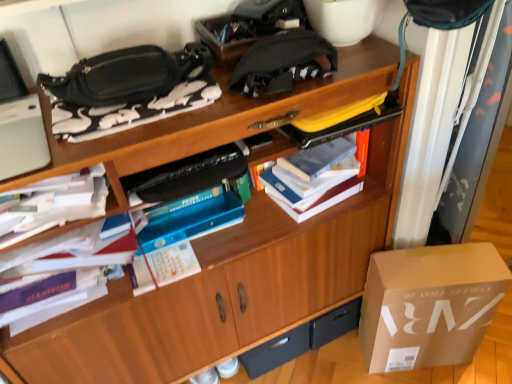
Question: Does white paper stack at left, the fourth book in the right-to-left sequence, appear on the left side of black matte drawer at lower center?

Choices:
 (A) no
 (B) yes

Answer: (B)

Question: Is the surface of white paper stack at left, which ranks as the 1th book in left-to-right order, in direct contact with black matte drawer at lower center?

Choices:
 (A) yes
 (B) no

Answer: (B)

Question: From a real-world perspective, is white paper stack at left, the fourth book in the right-to-left sequence, beneath black matte drawer at lower center?

Choices:
 (A) yes
 (B) no

Answer: (B)

Question: From the image's perspective, is white paper stack at left, the fourth book in the right-to-left sequence, over black matte drawer at lower center?

Choices:
 (A) yes
 (B) no

Answer: (A)

Question: From the image's perspective, does white paper stack at left, the fourth book in the right-to-left sequence, appear lower than black matte drawer at lower center?

Choices:
 (A) no
 (B) yes

Answer: (A)

Question: Is white paper at left, which is the second book in left-to-right order, wider or thinner than black fabric pouch at upper center?

Choices:
 (A) thin
 (B) wide

Answer: (B)

Question: From the image's perspective, is white paper at left, which is the second book in left-to-right order, located above or below black fabric pouch at upper center?

Choices:
 (A) below
 (B) above

Answer: (A)

Question: In the image, is white paper at left, acting as the third book starting from the right, positioned in front of or behind black fabric pouch at upper center?

Choices:
 (A) front
 (B) behind

Answer: (A)

Question: Choose the correct answer: Is white paper at left, which is the second book in left-to-right order, inside black fabric pouch at upper center or outside it?

Choices:
 (A) outside
 (B) inside

Answer: (A)

Question: Do you think black fabric pouch at upper center is within black matte drawer at lower center, or outside of it?

Choices:
 (A) outside
 (B) inside

Answer: (A)

Question: In the image, is black fabric pouch at upper center positioned in front of or behind black matte drawer at lower center?

Choices:
 (A) behind
 (B) front

Answer: (B)

Question: In terms of width, does black fabric pouch at upper center look wider or thinner when compared to black matte drawer at lower center?

Choices:
 (A) thin
 (B) wide

Answer: (A)

Question: From the image's perspective, relative to black matte drawer at lower center, is black fabric pouch at upper center above or below?

Choices:
 (A) below
 (B) above

Answer: (B)

Question: From the image's perspective, is white fabric curtain at upper right above or below matte cardboard box at lower right?

Choices:
 (A) above
 (B) below

Answer: (A)

Question: From a real-world perspective, is white fabric curtain at upper right positioned above or below matte cardboard box at lower right?

Choices:
 (A) above
 (B) below

Answer: (A)